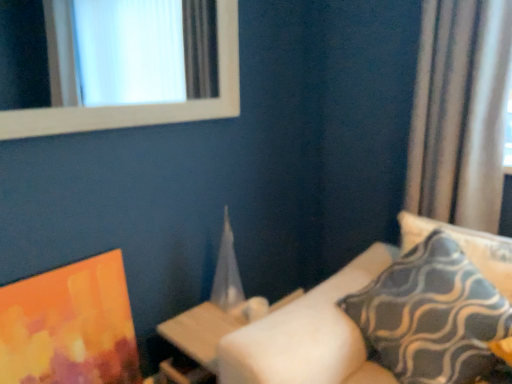
Question: Is wooden table at center thinner than patterned fabric pillow at right, which ranks as the 1th pillow in left-to-right order?

Choices:
 (A) yes
 (B) no

Answer: (B)

Question: Is wooden table at center aimed at patterned fabric pillow at right, which ranks as the 1th pillow in left-to-right order?

Choices:
 (A) no
 (B) yes

Answer: (A)

Question: From a real-world perspective, is wooden table at center on patterned fabric pillow at right, which ranks as the 1th pillow in left-to-right order?

Choices:
 (A) yes
 (B) no

Answer: (B)

Question: Can you see wooden table at center touching patterned fabric pillow at right, which is counted as the 2th pillow, starting from the right?

Choices:
 (A) no
 (B) yes

Answer: (A)

Question: Can you confirm if wooden table at center is positioned to the right of patterned fabric pillow at right, which is counted as the 2th pillow, starting from the right?

Choices:
 (A) no
 (B) yes

Answer: (A)

Question: Considering the relative sizes of wooden table at center and patterned fabric pillow at right, which ranks as the 1th pillow in left-to-right order, in the image provided, is wooden table at center wider than patterned fabric pillow at right, which ranks as the 1th pillow in left-to-right order,?

Choices:
 (A) no
 (B) yes

Answer: (B)

Question: From a real-world perspective, is wooden table at center beneath matte orange painting at lower left?

Choices:
 (A) yes
 (B) no

Answer: (A)

Question: Does wooden table at center appear on the left side of matte orange painting at lower left?

Choices:
 (A) no
 (B) yes

Answer: (A)

Question: Is the position of wooden table at center less distant than that of matte orange painting at lower left?

Choices:
 (A) yes
 (B) no

Answer: (B)

Question: Considering the relative sizes of wooden table at center and matte orange painting at lower left in the image provided, is wooden table at center taller than matte orange painting at lower left?

Choices:
 (A) yes
 (B) no

Answer: (B)

Question: Is matte orange painting at lower left inside wooden table at center?

Choices:
 (A) no
 (B) yes

Answer: (A)

Question: From the image's perspective, is wooden table at center located beneath matte orange painting at lower left?

Choices:
 (A) no
 (B) yes

Answer: (B)

Question: Considering the relative positions of patterned fabric pillow at right, which ranks as the 1th pillow in left-to-right order, and blue-patterned fabric pillow at right, positioned as the second pillow in left-to-right order, in the image provided, is patterned fabric pillow at right, which ranks as the 1th pillow in left-to-right order, in front of blue-patterned fabric pillow at right, positioned as the second pillow in left-to-right order,?

Choices:
 (A) no
 (B) yes

Answer: (B)